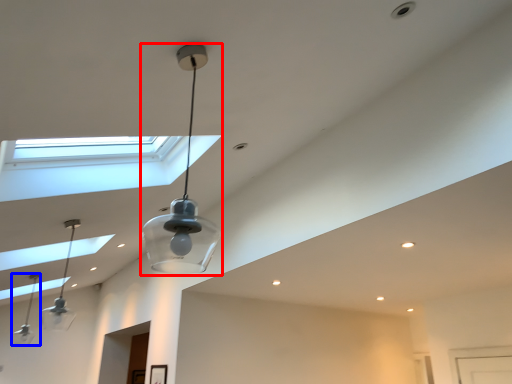
Question: Which object is closer to the camera taking this photo, lamp (highlighted by a red box) or lamp (highlighted by a blue box)?

Choices:
 (A) lamp
 (B) lamp

Answer: (A)